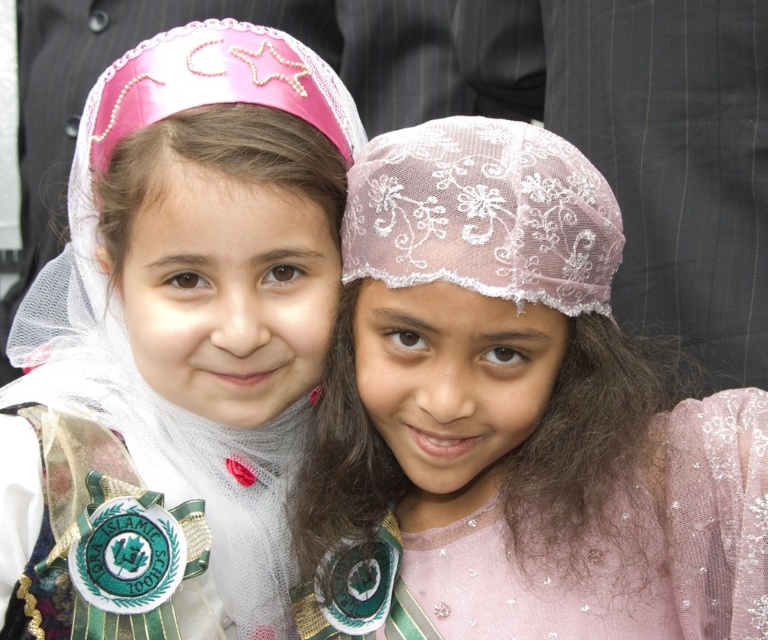
You are a photographer who wants to capture a closeup of the pink lace headscarf at center. Based on the coordinates provided, where should you focus your camera?

The pink lace headscarf at center is located at coordinates point (515, 416), so you should focus your camera there.